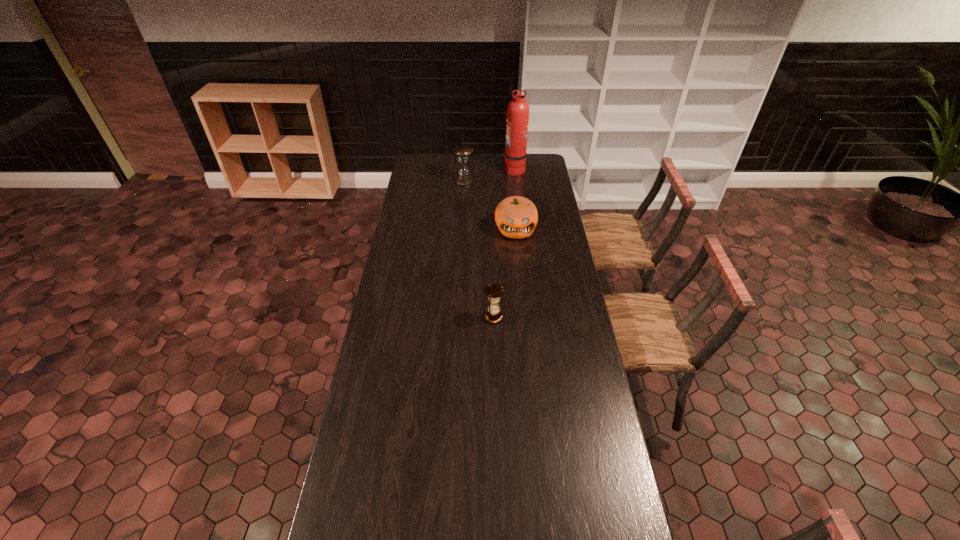
This screenshot has height=540, width=960. I want to click on free space between the left hourglass and the tallest object, so click(x=489, y=174).

I want to click on unoccupied position between the nearer hourglass and the pumpkin, so [504, 273].

Locate an element on the screen. free space that is in between the tallest object and the right hourglass is located at coordinates (504, 243).

The height and width of the screenshot is (540, 960). Find the location of `vacant region between the nearest object and the pumpkin`. vacant region between the nearest object and the pumpkin is located at coordinates (504, 273).

Where is `free space that is in between the leftmost object and the shorter hourglass`? This screenshot has height=540, width=960. free space that is in between the leftmost object and the shorter hourglass is located at coordinates (478, 248).

Locate an element on the screen. This screenshot has height=540, width=960. blank region between the left hourglass and the shortest object is located at coordinates (478, 248).

The width and height of the screenshot is (960, 540). What are the coordinates of `vacant area that lies between the pumpkin and the taller hourglass` in the screenshot? It's located at (490, 205).

Locate which object ranks second in proximity to the nearest object. Please provide its 2D coordinates. Your answer should be formatted as a tuple, i.e. [(x, y)], where the tuple contains the x and y coordinates of a point satisfying the conditions above.

[(463, 177)]

Identify which object is the nearest to the farther hourglass. Please provide its 2D coordinates. Your answer should be formatted as a tuple, i.e. [(x, y)], where the tuple contains the x and y coordinates of a point satisfying the conditions above.

[(517, 120)]

In order to click on vacant space that satisfies the following two spatial constraints: 1. on the label side of the fire extinguisher; 2. on the face of the pumpkin in this screenshot , I will do `click(521, 229)`.